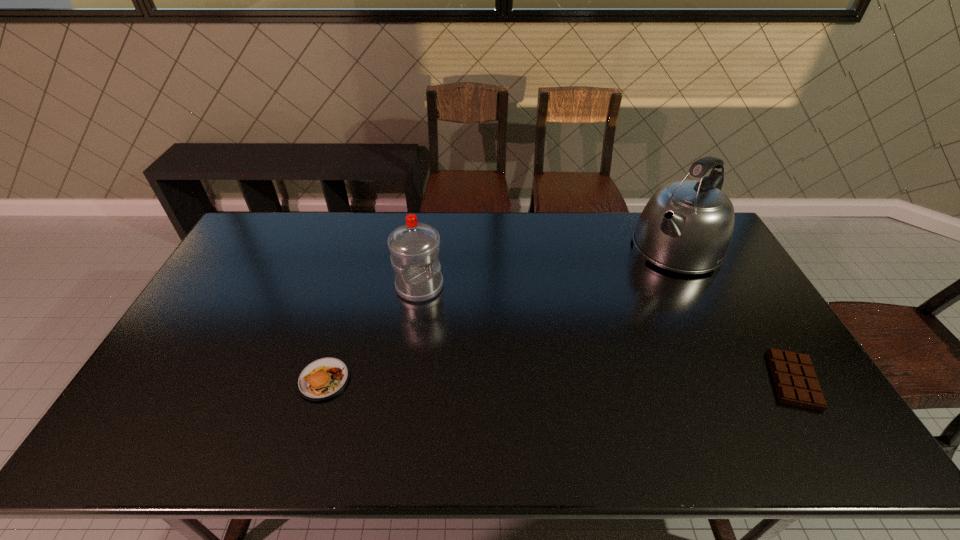
Identify the location of object that is at the near right corner. (795, 380).

This screenshot has width=960, height=540. Identify the location of vacant area at the far edge of the desktop. (510, 219).

Where is `free space at the near edge of the desktop`? Image resolution: width=960 pixels, height=540 pixels. free space at the near edge of the desktop is located at coordinates (593, 397).

This screenshot has height=540, width=960. In the image, there is a desktop. In order to click on free space at the left edge in this screenshot , I will do `click(210, 292)`.

The height and width of the screenshot is (540, 960). I want to click on free space at the right edge of the desktop, so [x=748, y=322].

Find the location of a particular element. blank space at the near left corner of the desktop is located at coordinates (184, 409).

This screenshot has height=540, width=960. Find the location of `vacant area between the candy bar and the tallest object`. vacant area between the candy bar and the tallest object is located at coordinates (735, 314).

Find the location of a particular element. empty location between the second shortest object and the kettle is located at coordinates (500, 314).

Locate an element on the screen. The width and height of the screenshot is (960, 540). unoccupied position between the leftmost object and the third shortest object is located at coordinates (372, 333).

This screenshot has width=960, height=540. I want to click on blank region between the leftmost object and the tallest object, so click(500, 314).